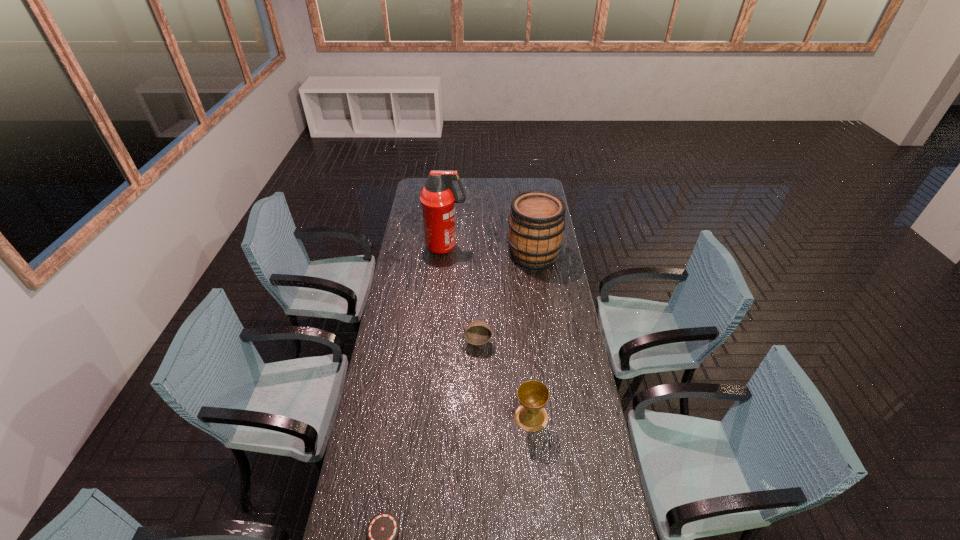
Find the location of `fire extinguisher`. fire extinguisher is located at coordinates (438, 197).

Locate an element on the screen. the fourth shortest object is located at coordinates (536, 223).

Identify the location of the third tallest object. The image size is (960, 540). (533, 395).

Where is `chalice`? The image size is (960, 540). chalice is located at coordinates (533, 395).

Identify the location of the second shortest object. Image resolution: width=960 pixels, height=540 pixels. (477, 332).

This screenshot has width=960, height=540. In order to click on bowl in this screenshot , I will do `click(477, 332)`.

Where is `vacant area situated 0.130m on the trigger side of the tallest object`? The image size is (960, 540). vacant area situated 0.130m on the trigger side of the tallest object is located at coordinates (491, 247).

The width and height of the screenshot is (960, 540). In order to click on vacant region located on the back of the cider in this screenshot , I will do `click(529, 220)`.

The width and height of the screenshot is (960, 540). I want to click on vacant space located 0.120m on the front of the third shortest object, so click(536, 464).

Where is `free location located on the back of the fourth tallest object`? The width and height of the screenshot is (960, 540). free location located on the back of the fourth tallest object is located at coordinates (478, 326).